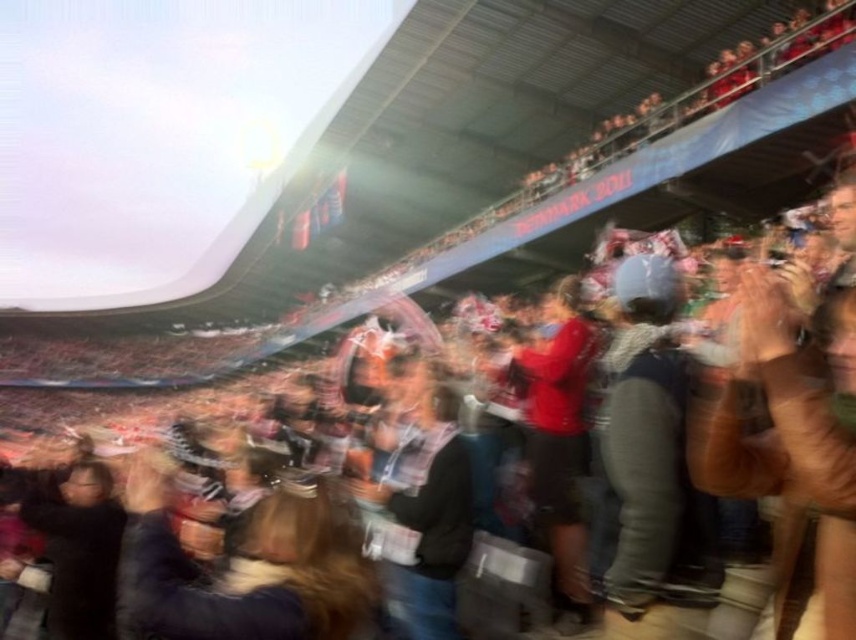
Question: Among these objects, which one is nearest to the camera?

Choices:
 (A) dark brown leather jacket at center
 (B) dark gray fabric crowd at center

Answer: (B)

Question: Can you confirm if dark brown leather jacket at center is thinner than dark gray sweater at center?

Choices:
 (A) no
 (B) yes

Answer: (A)

Question: Which point is farther to the camera?

Choices:
 (A) dark gray fabric crowd at center
 (B) dark gray sweater at center

Answer: (B)

Question: Is dark gray sweater at center smaller than dark gray fabric crowd at center?

Choices:
 (A) no
 (B) yes

Answer: (A)

Question: Does dark brown leather jacket at center appear over dark gray sweater at center?

Choices:
 (A) no
 (B) yes

Answer: (A)

Question: Which point is closer to the camera?

Choices:
 (A) dark brown leather jacket at center
 (B) dark gray sweater at center
 (C) dark gray fabric crowd at center

Answer: (C)